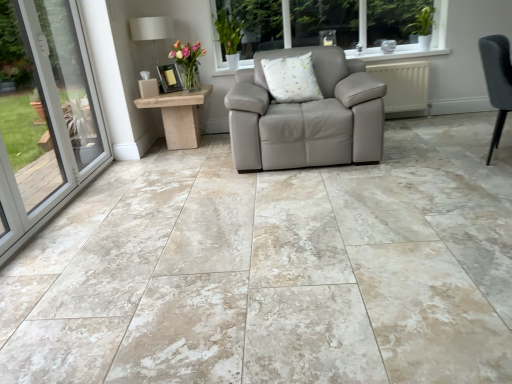
Image resolution: width=512 pixels, height=384 pixels. Find the location of `free space behind dark gray fabric chair at right`. free space behind dark gray fabric chair at right is located at coordinates (451, 143).